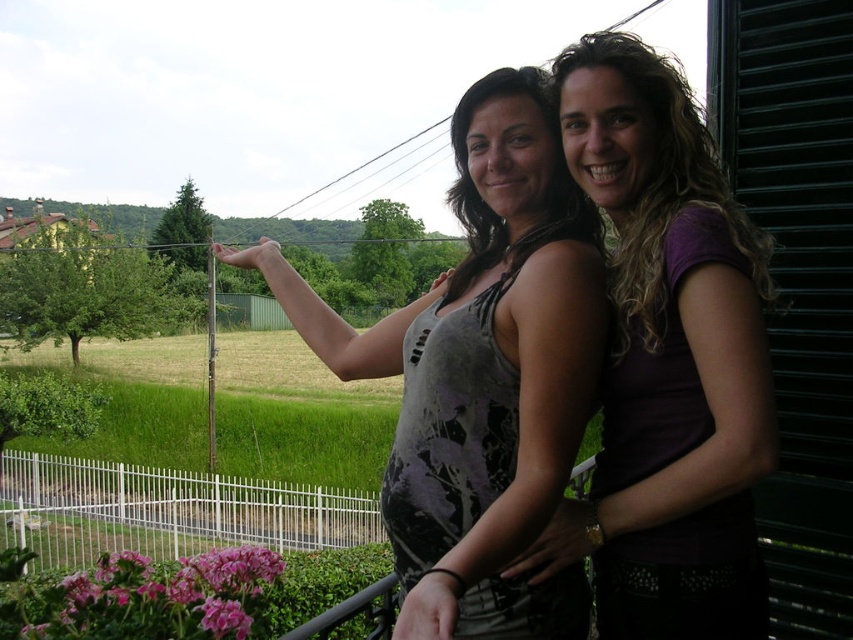
Measure the distance between gray printed tank top at center and camera.

gray printed tank top at center is 1.51 meters from camera.

Which is above, gray printed tank top at center or purple matte shirt at upper right?

Positioned higher is purple matte shirt at upper right.

The height and width of the screenshot is (640, 853). What do you see at coordinates (480, 372) in the screenshot?
I see `gray printed tank top at center` at bounding box center [480, 372].

In order to click on gray printed tank top at center in this screenshot , I will do `click(480, 372)`.

Who is more forward, (746,420) or (573,141)?

Point (746,420)

Can you confirm if purple matte tank top at center is shorter than purple matte shirt at upper right?

No.

Which is in front, point (695, 396) or point (628, 305)?

Positioned in front is point (695, 396).

In order to click on purple matte tank top at center in this screenshot , I will do `click(666, 362)`.

Is point (517, 74) farther from viewer compared to point (717, 609)?

Yes, point (517, 74) is behind point (717, 609).

Who is taller, gray printed tank top at center or purple matte tank top at center?

With more height is purple matte tank top at center.

What do you see at coordinates (480, 372) in the screenshot? The height and width of the screenshot is (640, 853). I see `gray printed tank top at center` at bounding box center [480, 372].

Identify the location of gray printed tank top at center. (480, 372).